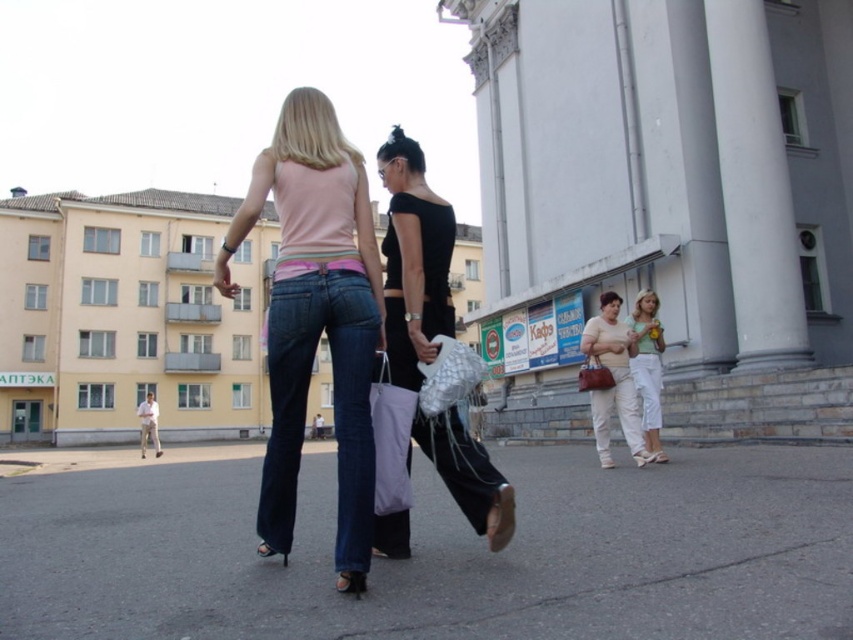
Question: Which is nearer to the matte beige pants at lower right?

Choices:
 (A) gray asphalt at center
 (B) black leather dress at center
 (C) white cotton pants at lower right
 (D) denim jeans at center

Answer: (C)

Question: Which point is farther from the camera taking this photo?

Choices:
 (A) (624, 630)
 (B) (485, 518)

Answer: (B)

Question: Which object is the farthest from the denim jeans at center?

Choices:
 (A) gray asphalt at center
 (B) black leather dress at center

Answer: (B)

Question: Is denim at center smaller than matte beige pants at lower right?

Choices:
 (A) yes
 (B) no

Answer: (B)

Question: Considering the relative positions of gray asphalt at center and black leather dress at center in the image provided, where is gray asphalt at center located with respect to black leather dress at center?

Choices:
 (A) below
 (B) above

Answer: (A)

Question: Is gray asphalt at center bigger than black leather dress at center?

Choices:
 (A) no
 (B) yes

Answer: (B)